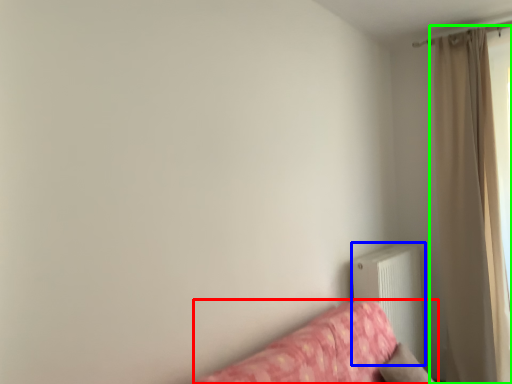
Question: Which object is positioned farthest from studio couch (highlighted by a red box)? Select from radiator (highlighted by a blue box) and curtain (highlighted by a green box).

Choices:
 (A) radiator
 (B) curtain

Answer: (B)